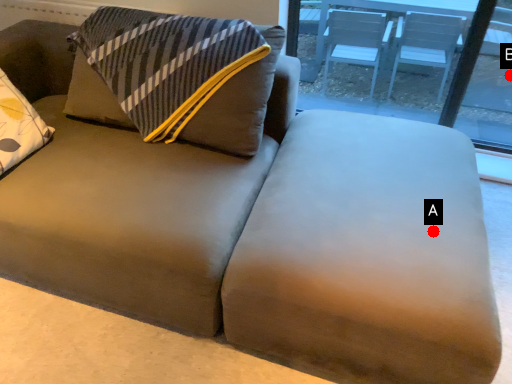
Question: Two points are circled on the image, labeled by A and B beside each circle. Which point is farther from the camera taking this photo?

Choices:
 (A) A is further
 (B) B is further

Answer: (B)